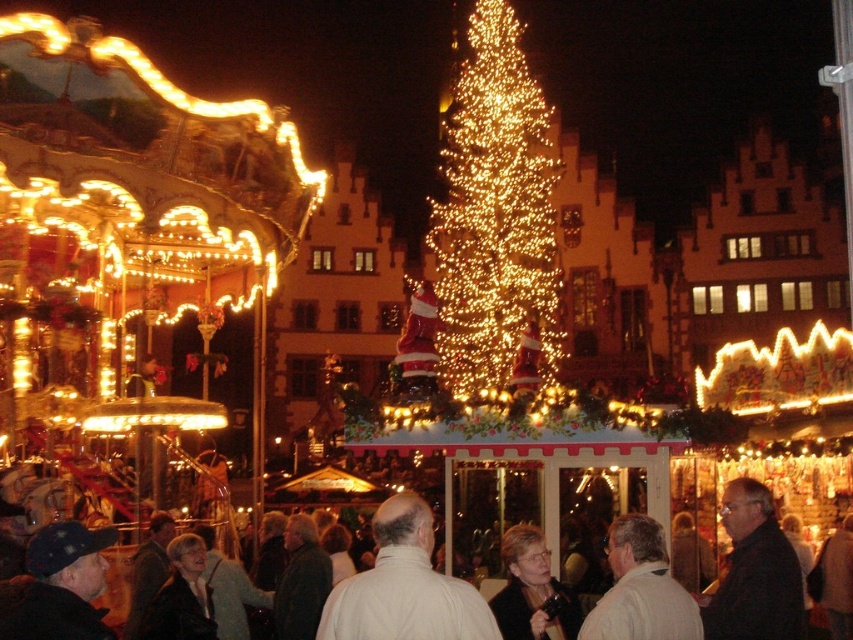
Does dark clothing crowd at center have a lesser width compared to white matte jacket at lower center?

No, dark clothing crowd at center is not thinner than white matte jacket at lower center.

Does dark clothing crowd at center come in front of white matte jacket at lower center?

That is True.

What do you see at coordinates (700, 595) in the screenshot? I see `dark clothing crowd at center` at bounding box center [700, 595].

At what (x,y) coordinates should I click in order to perform the action: click on dark clothing crowd at center. Please return your answer as a coordinate pair (x, y). This screenshot has height=640, width=853. Looking at the image, I should click on (700, 595).

Between dark clothing crowd at center and white matte jacket at center, which one is positioned higher?

white matte jacket at center

Does point (340, 614) come closer to viewer compared to point (421, 566)?

Yes, it is in front of point (421, 566).

Is point (735, 554) positioned before point (368, 570)?

Yes, it is.

Where is `dark clothing crowd at center`? Image resolution: width=853 pixels, height=640 pixels. dark clothing crowd at center is located at coordinates (700, 595).

Between dark gray sweater at center and white matte jacket at lower center, which one has more height?

Standing taller between the two is dark gray sweater at center.

Where is `dark gray sweater at center`? This screenshot has width=853, height=640. dark gray sweater at center is located at coordinates (753, 572).

I want to click on dark gray sweater at center, so click(753, 572).